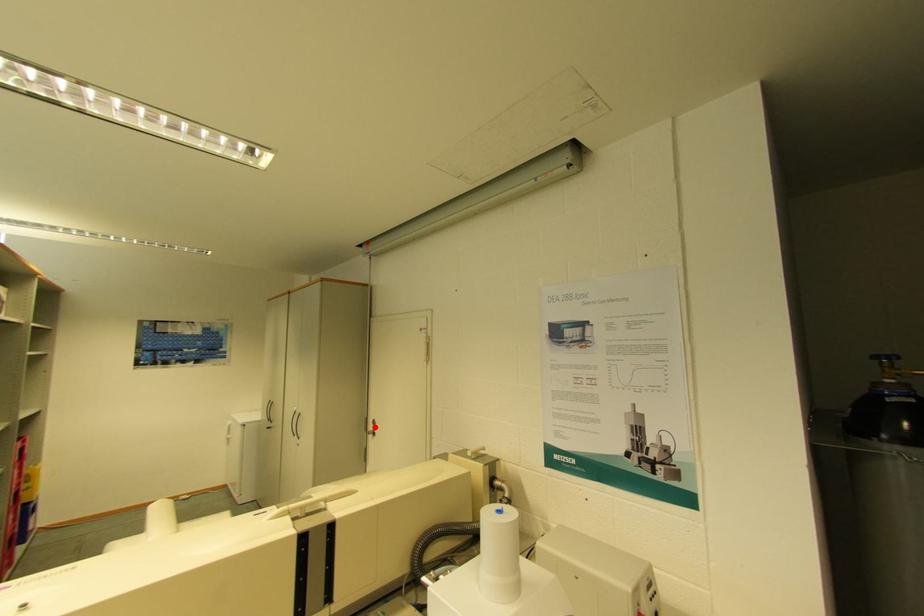
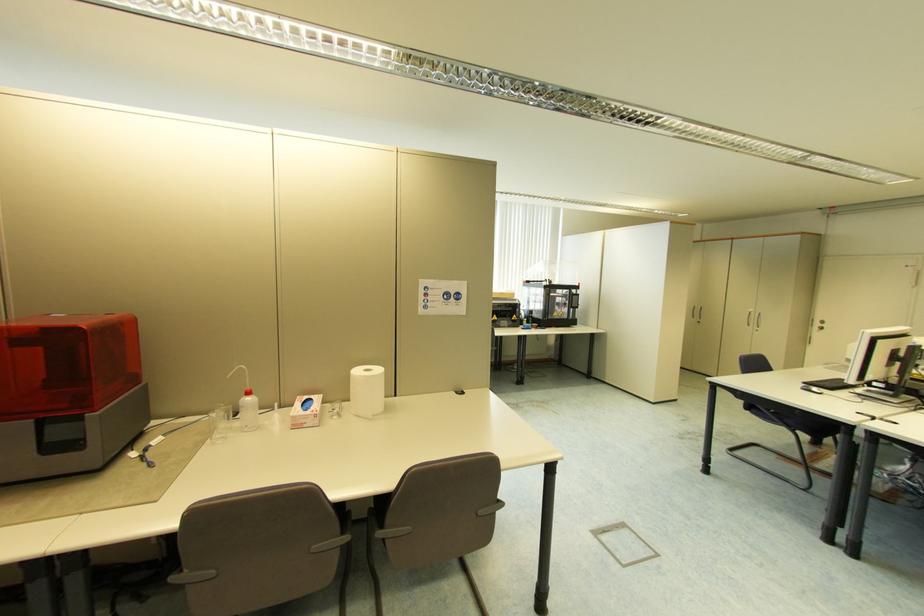
Find the pixel in the second image that matches the highlighted location in the first image.

(821, 325)